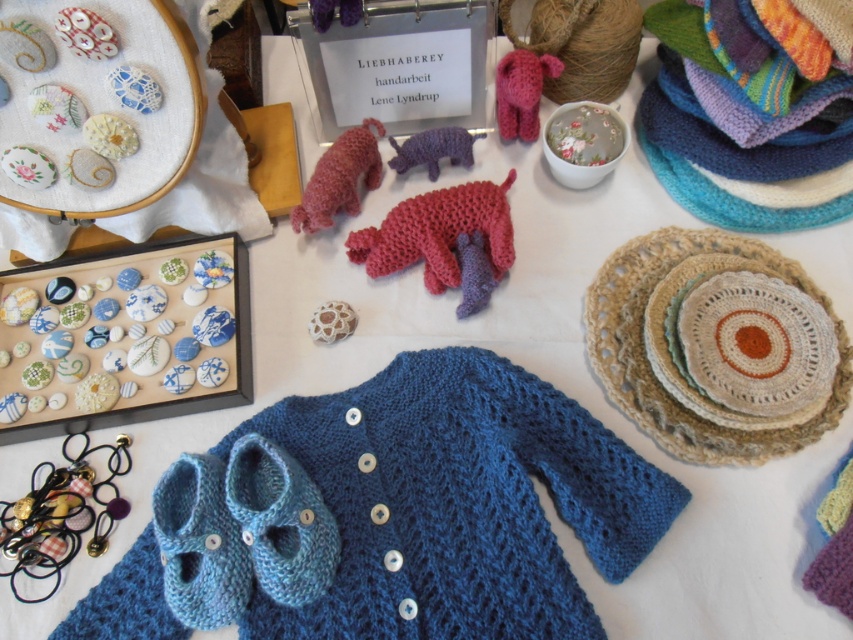
Question: Which is nearer to the knitted wool dog at center?

Choices:
 (A) knitted woolen dog at center
 (B) purple knitted toy at center
 (C) knitted pink elephant at upper center
 (D) blue knitted sweater at center

Answer: (B)

Question: Is the position of knitted woolen dog at center less distant than that of knitted pink elephant at upper center?

Choices:
 (A) yes
 (B) no

Answer: (A)

Question: Which point appears closest to the camera in this image?

Choices:
 (A) (650, 504)
 (B) (378, 131)
 (C) (526, 134)

Answer: (A)

Question: Does knitted wool dog at center have a larger size compared to white lace button at center?

Choices:
 (A) yes
 (B) no

Answer: (A)

Question: Which object appears closest to the camera in this image?

Choices:
 (A) knitted pink elephant at upper center
 (B) blue knitted sweater at center

Answer: (B)

Question: Can you confirm if knitted wool dog at center is wider than knitted pink elephant at upper center?

Choices:
 (A) no
 (B) yes

Answer: (B)